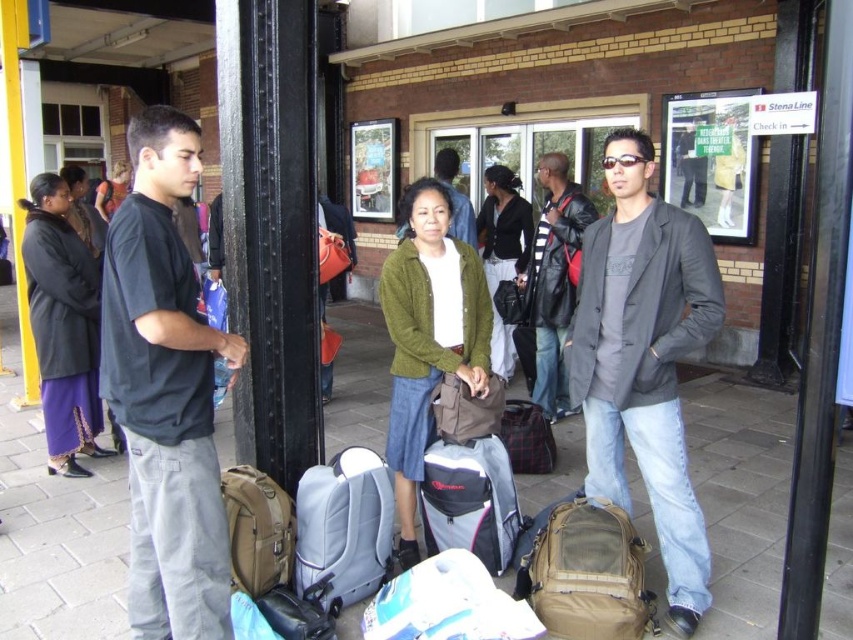
You are standing in the transportation hub and need to locate two specific points marked in the scene. The first point is at coordinate point (387, 291) and the second is at point (521, 300). Which of these two points is closer to your current position?

Point (387, 291) is closer to the viewer than point (521, 300).

You are a traveler who just arrived at the transportation hub and need to retrieve your belongings. You see both the green knitted cardigan at center and the matte black backpack at center. Which item is closer to you?

The green knitted cardigan at center is closer to you because it is in front of the matte black backpack at center.